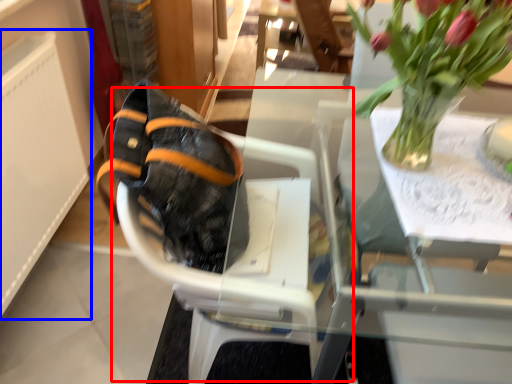
Question: Which object appears closest to the camera in this image, baby carriage (highlighted by a red box) or radiator (highlighted by a blue box)?

Choices:
 (A) baby carriage
 (B) radiator

Answer: (A)